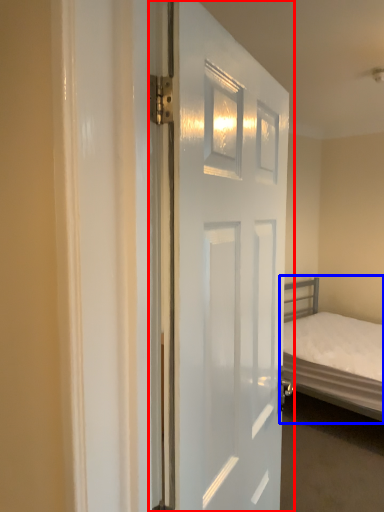
Question: Among these objects, which one is nearest to the camera, door (highlighted by a red box) or bed (highlighted by a blue box)?

Choices:
 (A) door
 (B) bed

Answer: (A)